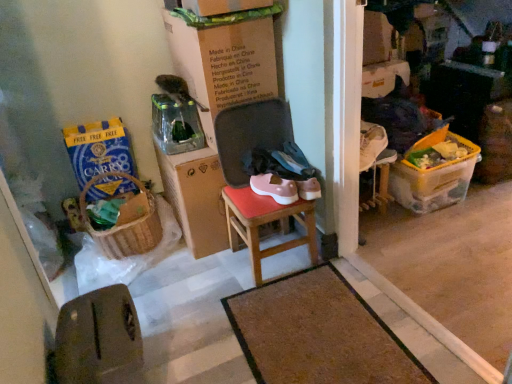
Image resolution: width=512 pixels, height=384 pixels. Describe the element at coordinates (223, 61) in the screenshot. I see `cardboard box at center` at that location.

Image resolution: width=512 pixels, height=384 pixels. I want to click on woven brown picnic basket at lower left, so click(126, 222).

Measure the distance between brown textured mat at center and camera.

brown textured mat at center and camera are 1.27 meters apart from each other.

Measure the distance between point [362,377] and camera.

They are 4.29 feet apart.

This screenshot has height=384, width=512. Identify the location of wooden stool at center. [x=265, y=224].

Can brown leather chair at lower left be found inside brown textured mat at center?

Definitely not — brown leather chair at lower left is not inside brown textured mat at center.

Is brown textured mat at center positioned far away from brown leather chair at lower left?

brown textured mat at center is near brown leather chair at lower left, not far away.

Is brown textured mat at center taller or shorter than brown leather chair at lower left?

Considering their sizes, brown textured mat at center has less height than brown leather chair at lower left.

Visually, is brown textured mat at center positioned to the left or to the right of brown leather chair at lower left?

From the image, it's evident that brown textured mat at center is to the right of brown leather chair at lower left.

In the scene shown: From the image's perspective, who appears lower, cardboard box at center or woven brown picnic basket at lower left?

woven brown picnic basket at lower left, from the image's perspective.

Is cardboard box at center touching woven brown picnic basket at lower left?

No, cardboard box at center is not making contact with woven brown picnic basket at lower left.

Can we say cardboard box at center lies outside woven brown picnic basket at lower left?

cardboard box at center is positioned outside woven brown picnic basket at lower left.

Considering the relative sizes of cardboard box at center and woven brown picnic basket at lower left in the image provided, is cardboard box at center shorter than woven brown picnic basket at lower left?

No, cardboard box at center is not shorter than woven brown picnic basket at lower left.

From the image's perspective, which is below, blue paper bag at left, arranged as the second box when viewed from the right, or yellow plastic container at right, which is the 2th box in left-to-right order?

yellow plastic container at right, which is the 2th box in left-to-right order, from the image's perspective.

In the image, there is a blue paper bag at left, which is the first box in left-to-right order. Where is `box below it (from a real-world perspective)`? box below it (from a real-world perspective) is located at coordinates (433, 181).

Considering the positions of objects blue paper bag at left, arranged as the second box when viewed from the right, and yellow plastic container at right, placed as the first box when sorted from right to left, in the image provided, who is behind, blue paper bag at left, arranged as the second box when viewed from the right, or yellow plastic container at right, placed as the first box when sorted from right to left,?

yellow plastic container at right, placed as the first box when sorted from right to left, is further from the camera.

Does blue paper bag at left, arranged as the second box when viewed from the right, touch yellow plastic container at right, placed as the first box when sorted from right to left?

No.

From their relative heights in the image, would you say yellow plastic container at right, placed as the first box when sorted from right to left, is taller or shorter than brown leather chair at lower left?

Considering their sizes, yellow plastic container at right, placed as the first box when sorted from right to left, has less height than brown leather chair at lower left.

Is yellow plastic container at right, which is the 2th box in left-to-right order, positioned far away from brown leather chair at lower left?

yellow plastic container at right, which is the 2th box in left-to-right order, is far away from brown leather chair at lower left.

Is yellow plastic container at right, which is the 2th box in left-to-right order, at the left side of brown leather chair at lower left?

In fact, yellow plastic container at right, which is the 2th box in left-to-right order, is to the right of brown leather chair at lower left.

From the image's perspective, between yellow plastic container at right, which is the 2th box in left-to-right order, and brown leather chair at lower left, who is located below?

brown leather chair at lower left is shown below in the image.

Is brown leather chair at lower left positioned with its back to cardboard box at center?

brown leather chair at lower left does not have its back to cardboard box at center.

Is brown leather chair at lower left located outside cardboard box at center?

brown leather chair at lower left lies outside cardboard box at center's area.

From a real-world perspective, is brown leather chair at lower left positioned under cardboard box at center based on gravity?

Yes, from a real-world perspective, brown leather chair at lower left is below cardboard box at center.

From the image's perspective, is brown leather chair at lower left above or below yellow plastic container at right, which is the 2th box in left-to-right order?

From the image's perspective, brown leather chair at lower left appears below yellow plastic container at right, which is the 2th box in left-to-right order.

Are brown leather chair at lower left and yellow plastic container at right, placed as the first box when sorted from right to left, far apart?

Absolutely, brown leather chair at lower left is distant from yellow plastic container at right, placed as the first box when sorted from right to left.

Considering the points (111, 309) and (477, 157), which point is in front, point (111, 309) or point (477, 157)?

The point (111, 309) is closer to the camera.

Is brown leather chair at lower left smaller than yellow plastic container at right, placed as the first box when sorted from right to left?

Actually, brown leather chair at lower left might be larger than yellow plastic container at right, placed as the first box when sorted from right to left.

Can you confirm if cardboard box at center is smaller than wooden stool at center?

No.

Considering the relative positions of cardboard box at center and wooden stool at center in the image provided, is cardboard box at center to the left of wooden stool at center from the viewer's perspective?

Indeed, cardboard box at center is positioned on the left side of wooden stool at center.

Can you tell me how much cardboard box at center and wooden stool at center differ in facing direction?

There is a 2.92-degree angle between the facing directions of cardboard box at center and wooden stool at center.

Find the location of a particular element. Image resolution: width=512 pixels, height=384 pixels. doormat below the brown leather chair at lower left (from the image's perspective) is located at coordinates (318, 334).

Where is `cardboard box above the woven brown picnic basket at lower left (from a real-world perspective)`? cardboard box above the woven brown picnic basket at lower left (from a real-world perspective) is located at coordinates (223, 61).

Based on their spatial positions, is cardboard box at center or pink rubber shoes at center closer to brown leather chair at lower left?

pink rubber shoes at center.

Looking at the image, which one is located further to pink rubber shoes at center, cardboard box at center or brown leather chair at lower left?

brown leather chair at lower left is positioned further to the anchor pink rubber shoes at center.

From the picture: Considering their positions, is wooden stool at center positioned closer to brown textured mat at center than cardboard box at center?

Among the two, wooden stool at center is located nearer to brown textured mat at center.

Considering their positions, is brown leather chair at lower left positioned closer to cardboard box at center than woven brown picnic basket at lower left?

The object closer to cardboard box at center is woven brown picnic basket at lower left.

Considering their positions, is cardboard box at center positioned further to woven brown picnic basket at lower left than brown leather chair at lower left?

brown leather chair at lower left is positioned further to the anchor woven brown picnic basket at lower left.

Looking at the image, which one is located further to pink rubber shoes at center, cardboard box at center or brown textured mat at center?

brown textured mat at center.

Which object lies further to the anchor point cardboard box at center, brown leather chair at lower left or yellow plastic container at right, placed as the first box when sorted from right to left?

The object further to cardboard box at center is yellow plastic container at right, placed as the first box when sorted from right to left.

Based on their spatial positions, is cardboard box at center or woven brown picnic basket at lower left further from pink rubber shoes at center?

The object further to pink rubber shoes at center is woven brown picnic basket at lower left.

Locate an element on the screen. The image size is (512, 384). stool situated between woven brown picnic basket at lower left and pink rubber shoes at center from left to right is located at coordinates (265, 224).

This screenshot has width=512, height=384. Identify the location of picnic basket between blue paper bag at left, which is the first box in left-to-right order, and brown textured mat at center. (126, 222).

At what (x,y) coordinates should I click in order to perform the action: click on cardboard box between blue paper bag at left, which is the first box in left-to-right order, and wooden stool at center from left to right. Please return your answer as a coordinate pair (x, y). This screenshot has height=384, width=512. Looking at the image, I should click on (223, 61).

Locate an element on the screen. This screenshot has height=384, width=512. stool between brown leather chair at lower left and blue paper bag at left, which is the first box in left-to-right order, in the front-back direction is located at coordinates (265, 224).